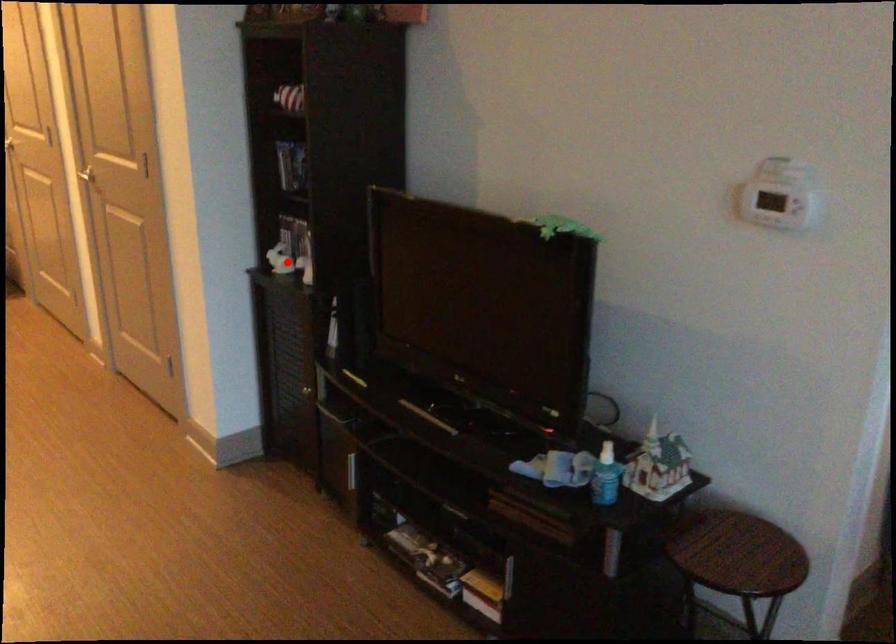
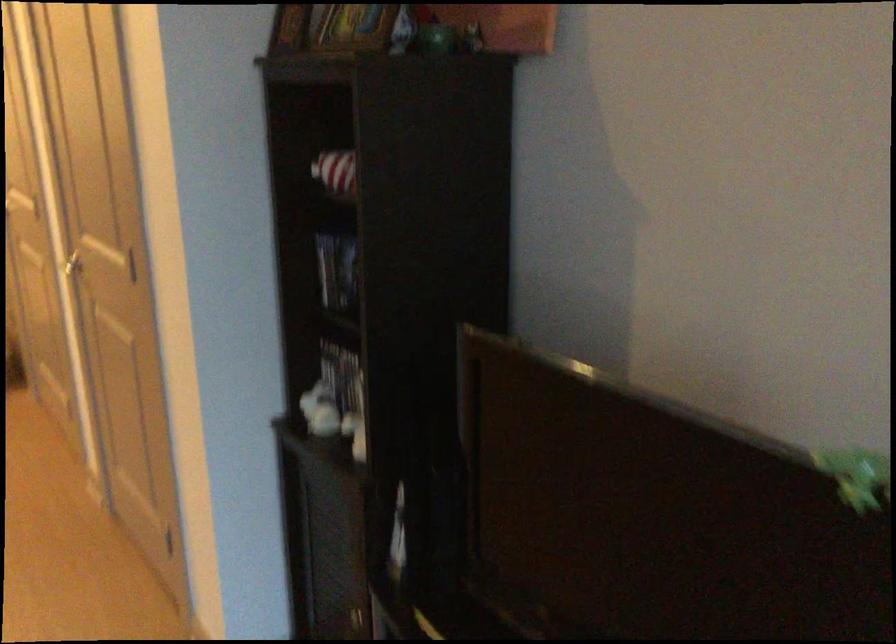
In the second image, find the point that corresponds to the highlighted location in the first image.

(332, 418)